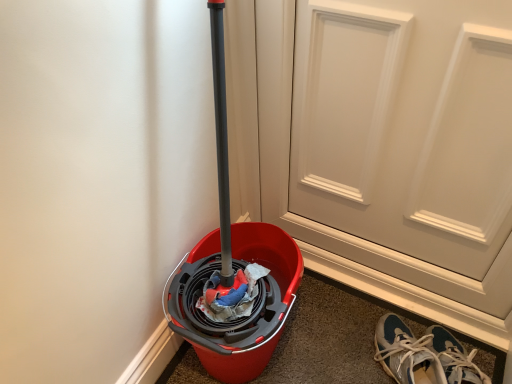
The width and height of the screenshot is (512, 384). In order to click on white matte door at center in this screenshot , I will do `click(406, 126)`.

Image resolution: width=512 pixels, height=384 pixels. Describe the element at coordinates (406, 126) in the screenshot. I see `white matte door at center` at that location.

Where is `blue suede sneakers at lower right`? This screenshot has height=384, width=512. blue suede sneakers at lower right is located at coordinates (406, 353).

Describe the element at coordinates (406, 353) in the screenshot. The width and height of the screenshot is (512, 384). I see `blue suede sneakers at lower right` at that location.

Measure the distance between blue suede sneakers at lower right and camera.

38.15 inches.

What is the approximate height of blue suede sneakers at lower right?

blue suede sneakers at lower right is 5.15 inches in height.

You are a GUI agent. You are given a task and a screenshot of the screen. Output one action in this format:
    pyautogui.click(x=<x>, y=<y>)
    Task: Click on the white matte door at center
    
    Given the screenshot: What is the action you would take?
    406,126

Considering the relative positions of blue suede sneakers at lower right and white matte door at center in the image provided, is blue suede sneakers at lower right to the right of white matte door at center from the viewer's perspective?

Indeed, blue suede sneakers at lower right is positioned on the right side of white matte door at center.

In the image, is blue suede sneakers at lower right positioned in front of or behind white matte door at center?

Clearly, blue suede sneakers at lower right is behind white matte door at center.

Between point (420, 355) and point (396, 250), which one is positioned in front?

The point (420, 355) is closer to the camera.

From the image's perspective, is blue suede sneakers at lower right above or below white matte door at center?

From the image's perspective, blue suede sneakers at lower right appears below white matte door at center.

From a real-world perspective, which is physically below, blue suede sneakers at lower right or white matte door at center?

blue suede sneakers at lower right, from a real-world perspective.

Considering the relative sizes of blue suede sneakers at lower right and white matte door at center in the image provided, is blue suede sneakers at lower right wider than white matte door at center?

Yes, blue suede sneakers at lower right is wider than white matte door at center.

In terms of height, does blue suede sneakers at lower right look taller or shorter compared to white matte door at center?

Considering their sizes, blue suede sneakers at lower right has less height than white matte door at center.

Considering the sizes of objects blue suede sneakers at lower right and white matte door at center in the image provided, who is smaller, blue suede sneakers at lower right or white matte door at center?

blue suede sneakers at lower right.

Choose the correct answer: Is blue suede sneakers at lower right inside white matte door at center or outside it?

blue suede sneakers at lower right lies outside white matte door at center.

Are blue suede sneakers at lower right and white matte door at center making contact?

No, blue suede sneakers at lower right is not making contact with white matte door at center.

Could you tell me if blue suede sneakers at lower right is facing white matte door at center?

No, blue suede sneakers at lower right is not turned towards white matte door at center.

Find the location of a particular element. The width and height of the screenshot is (512, 384). footwear lying on the right of white matte door at center is located at coordinates (406, 353).

Which is more to the left, white matte door at center or blue suede sneakers at lower right?

white matte door at center.

Is white matte door at center closer to the viewer compared to blue suede sneakers at lower right?

Yes, white matte door at center is closer to the camera.

Is point (496, 173) farther from viewer compared to point (442, 378)?

No.

From the image's perspective, is white matte door at center beneath blue suede sneakers at lower right?

No, from the image's perspective, white matte door at center is not below blue suede sneakers at lower right.

From a real-world perspective, relative to blue suede sneakers at lower right, is white matte door at center vertically above or below?

white matte door at center is above blue suede sneakers at lower right.

Which of these two, white matte door at center or blue suede sneakers at lower right, is wider?

blue suede sneakers at lower right.

Which of these two, white matte door at center or blue suede sneakers at lower right, stands taller?

white matte door at center.

Is white matte door at center smaller than blue suede sneakers at lower right?

No, white matte door at center is not smaller than blue suede sneakers at lower right.

Is blue suede sneakers at lower right inside white matte door at center?

No, blue suede sneakers at lower right is not a part of white matte door at center.

Is white matte door at center far away from blue suede sneakers at lower right?

No, white matte door at center is not far away from blue suede sneakers at lower right.

Could you tell me if white matte door at center is facing blue suede sneakers at lower right?

Yes, white matte door at center is oriented towards blue suede sneakers at lower right.

How different are the orientations of white matte door at center and blue suede sneakers at lower right in degrees?

The angle between the facing direction of white matte door at center and the facing direction of blue suede sneakers at lower right is 39.5 degrees.

Measure the distance from white matte door at center to blue suede sneakers at lower right.

They are 45.44 centimeters apart.

At what (x,y) coordinates should I click in order to perform the action: click on door lying on the left of blue suede sneakers at lower right. Please return your answer as a coordinate pair (x, y). The height and width of the screenshot is (384, 512). Looking at the image, I should click on (406, 126).

Find the location of `door above the blue suede sneakers at lower right (from a real-world perspective)`. door above the blue suede sneakers at lower right (from a real-world perspective) is located at coordinates (406, 126).

Locate an element on the screen. Image resolution: width=512 pixels, height=384 pixels. footwear that appears behind the white matte door at center is located at coordinates (406, 353).